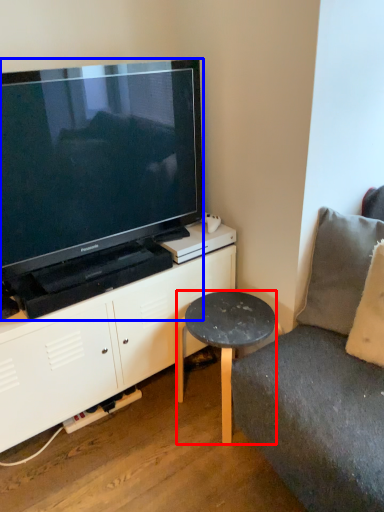
Question: Which of the following is the farthest to the observer, table (highlighted by a red box) or television (highlighted by a blue box)?

Choices:
 (A) table
 (B) television

Answer: (A)